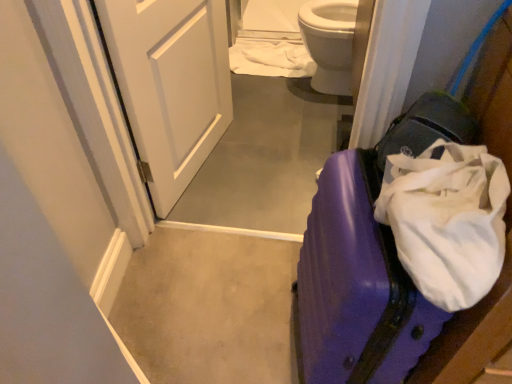
Describe the element at coordinates (270, 59) in the screenshot. The width and height of the screenshot is (512, 384). I see `white fabric at upper center` at that location.

What do you see at coordinates (170, 85) in the screenshot? This screenshot has height=384, width=512. I see `white glossy door at upper left` at bounding box center [170, 85].

This screenshot has height=384, width=512. Identify the location of purple glossy suitcase at lower right. (356, 285).

At what (x,y) coordinates should I click in order to perform the action: click on white fabric at upper center. Please return your answer as a coordinate pair (x, y). Image resolution: width=512 pixels, height=384 pixels. Looking at the image, I should click on (270, 59).

This screenshot has height=384, width=512. I want to click on suitcase lying below the white glossy door at upper left (from the image's perspective), so click(356, 285).

From the image's perspective, is purple glossy suitcase at lower right above white glossy door at upper left?

No, from the image's perspective, purple glossy suitcase at lower right is not above white glossy door at upper left.

Is the depth of purple glossy suitcase at lower right greater than that of white glossy door at upper left?

No, the depth of purple glossy suitcase at lower right is less than that of white glossy door at upper left.

Looking at this image, is purple glossy suitcase at lower right at the left side of white glossy door at upper left?

No.

Can we say purple glossy suitcase at lower right lies outside white fabric at upper center?

Yes, purple glossy suitcase at lower right is located beyond the bounds of white fabric at upper center.

Can you confirm if purple glossy suitcase at lower right is positioned to the left of white fabric at upper center?

No, purple glossy suitcase at lower right is not to the left of white fabric at upper center.

From the picture: In the image, is purple glossy suitcase at lower right positioned in front of or behind white fabric at upper center?

Clearly, purple glossy suitcase at lower right is in front of white fabric at upper center.

Which is behind, point (403, 284) or point (255, 45)?

The point (255, 45) is farther.

Measure the distance between white glossy door at upper left and white fabric at upper center.

white glossy door at upper left and white fabric at upper center are 34.01 inches apart from each other.

Does white glossy door at upper left turn towards white fabric at upper center?

No, white glossy door at upper left does not turn towards white fabric at upper center.

Identify the location of toilet paper located underneath the white glossy door at upper left (from a real-world perspective). The image size is (512, 384). (270, 59).

Looking at this image, in terms of size, does white glossy door at upper left appear bigger or smaller than white fabric at upper center?

In the image, white glossy door at upper left appears to be larger than white fabric at upper center.

Is white fabric at upper center wider or thinner than purple glossy suitcase at lower right?

Considering their sizes, white fabric at upper center looks broader than purple glossy suitcase at lower right.

Can you tell me how much white fabric at upper center and purple glossy suitcase at lower right differ in facing direction?

white fabric at upper center and purple glossy suitcase at lower right are facing 78.7 degrees away from each other.

Is white fabric at upper center surrounding purple glossy suitcase at lower right?

No.

Is white fabric at upper center aimed at purple glossy suitcase at lower right?

No, white fabric at upper center is not oriented towards purple glossy suitcase at lower right.

Locate an element on the screen. toilet paper on the right of the white glossy door at upper left is located at coordinates (270, 59).

How many degrees apart are the facing directions of white fabric at upper center and white glossy door at upper left?

79.6 degrees separate the facing orientations of white fabric at upper center and white glossy door at upper left.

From the image's perspective, who appears lower, white fabric at upper center or white glossy door at upper left?

white glossy door at upper left is shown below in the image.

Which of these two, white fabric at upper center or white glossy door at upper left, is bigger?

With larger size is white glossy door at upper left.

Is the surface of white glossy door at upper left in direct contact with purple glossy suitcase at lower right?

No, white glossy door at upper left is not with purple glossy suitcase at lower right.

Is white glossy door at upper left wider than purple glossy suitcase at lower right?

Incorrect, the width of white glossy door at upper left does not surpass that of purple glossy suitcase at lower right.

From the image's perspective, is white glossy door at upper left above or below purple glossy suitcase at lower right?

white glossy door at upper left is situated higher than purple glossy suitcase at lower right in the image.

From a real-world perspective, is white glossy door at upper left below purple glossy suitcase at lower right?

No, from a real-world perspective, white glossy door at upper left is not beneath purple glossy suitcase at lower right.

This screenshot has height=384, width=512. I want to click on door on the left of purple glossy suitcase at lower right, so click(x=170, y=85).

I want to click on suitcase located below the white fabric at upper center (from the image's perspective), so pos(356,285).

From the image, which object appears to be nearer to white glossy door at upper left, white fabric at upper center or purple glossy suitcase at lower right?

white fabric at upper center lies closer to white glossy door at upper left than the other object.

Considering their positions, is white glossy door at upper left positioned closer to white fabric at upper center than purple glossy suitcase at lower right?

The object closer to white fabric at upper center is white glossy door at upper left.

Based on their spatial positions, is white glossy door at upper left or white fabric at upper center further from purple glossy suitcase at lower right?

white fabric at upper center lies further to purple glossy suitcase at lower right than the other object.

Considering their positions, is purple glossy suitcase at lower right positioned closer to white fabric at upper center than white glossy door at upper left?

The object closer to white fabric at upper center is white glossy door at upper left.

Considering their positions, is white fabric at upper center positioned further to purple glossy suitcase at lower right than white glossy door at upper left?

Answer: Based on the image, white fabric at upper center appears to be further to purple glossy suitcase at lower right.

Considering their positions, is purple glossy suitcase at lower right positioned closer to white glossy door at upper left than white fabric at upper center?

white fabric at upper center.

This screenshot has width=512, height=384. Find the location of `door between purple glossy suitcase at lower right and white fabric at upper center from front to back`. door between purple glossy suitcase at lower right and white fabric at upper center from front to back is located at coordinates (170, 85).